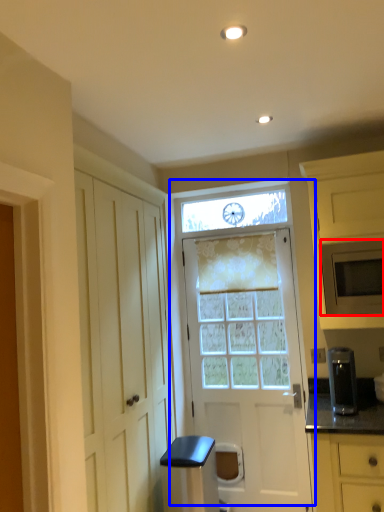
Question: Which point is closer to the camera, microwave oven (highlighted by a red box) or door (highlighted by a blue box)?

Choices:
 (A) microwave oven
 (B) door

Answer: (A)